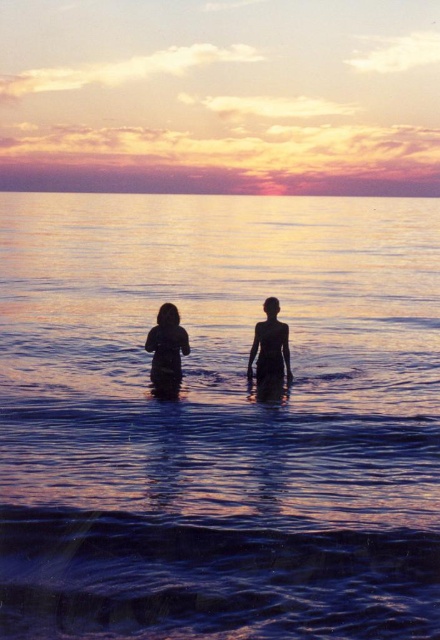
Does silhouette figures at center appear on the right side of dark matte figure at center?

Yes, silhouette figures at center is to the right of dark matte figure at center.

Looking at this image, who is more distant from viewer, (x=165, y=374) or (x=154, y=364)?

Positioned behind is point (x=154, y=364).

You are a GUI agent. You are given a task and a screenshot of the screen. Output one action in this format:
    pyautogui.click(x=<x>, y=<y>)
    Task: Click on the silhouette figures at center
    
    Given the screenshot: What is the action you would take?
    pyautogui.click(x=270, y=353)

Measure the distance between blue liquid water at center and silhouette figures at center.

44.14 feet

Between blue liquid water at center and silhouette figures at center, which one is positioned lower?

silhouette figures at center is lower down.

Is point (135, 525) behind point (169, 304)?

That is False.

Locate an element on the screen. blue liquid water at center is located at coordinates (219, 419).

Does point (305, 230) come closer to viewer compared to point (180, 333)?

No, (305, 230) is behind (180, 333).

The width and height of the screenshot is (440, 640). What are the coordinates of `blue liquid water at center` in the screenshot? It's located at (219, 419).